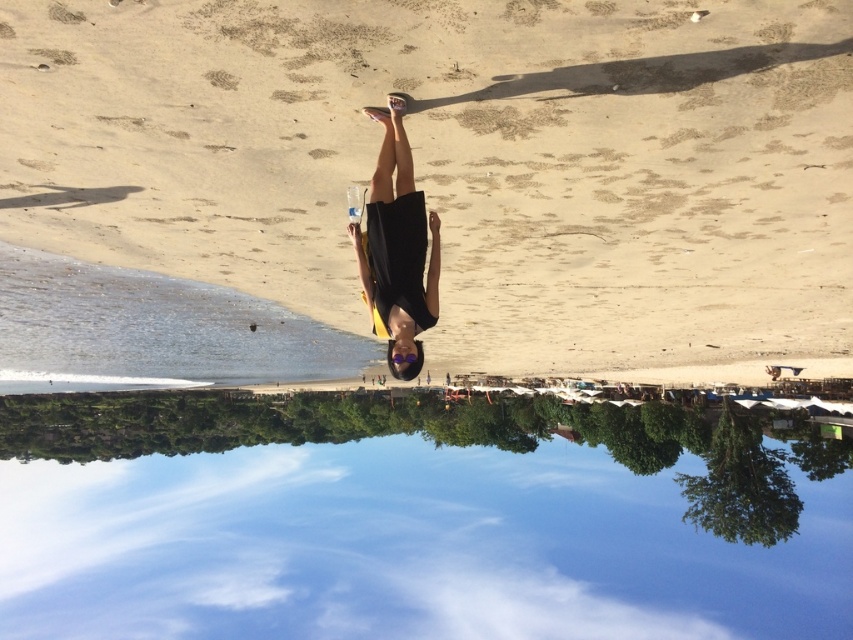
From the picture: Does beige sand at center lie in front of black matte dress at center?

Yes, it is in front of black matte dress at center.

Looking at this image, between beige sand at center and black matte dress at center, which one is positioned higher?

beige sand at center is above.

I want to click on beige sand at center, so (x=459, y=161).

Where is `beige sand at center`? The height and width of the screenshot is (640, 853). beige sand at center is located at coordinates (459, 161).

Which of these two, transparent glass water at center or black matte dress at center, stands shorter?

With less height is black matte dress at center.

Is point (76, 508) positioned before point (398, 259)?

No, (76, 508) is behind (398, 259).

Who is more forward, (397,625) or (367,273)?

Point (367,273)

Locate an element on the screen. The image size is (853, 640). transparent glass water at center is located at coordinates (415, 518).

Does beige sand at center have a lesser width compared to transparent glass water at center?

Yes, beige sand at center is thinner than transparent glass water at center.

This screenshot has width=853, height=640. Describe the element at coordinates (459, 161) in the screenshot. I see `beige sand at center` at that location.

Between point (102, 42) and point (699, 456), which one is positioned behind?

The point (699, 456) is more distant.

This screenshot has width=853, height=640. What are the coordinates of `beige sand at center` in the screenshot? It's located at (459, 161).